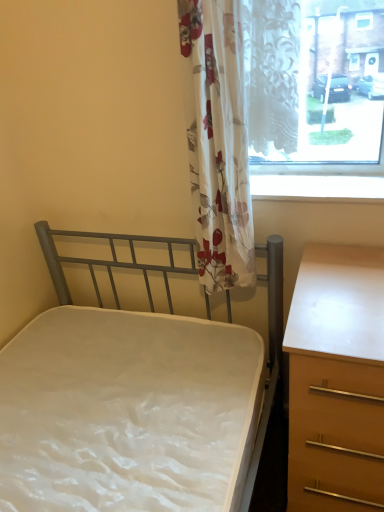
Question: Is metallic gray bed at center-left taller or shorter than floral fabric curtain at center?

Choices:
 (A) tall
 (B) short

Answer: (A)

Question: From the image's perspective, is metallic gray bed at center-left positioned above or below floral fabric curtain at center?

Choices:
 (A) below
 (B) above

Answer: (A)

Question: Which is farther from the metallic gray bed at center-left?

Choices:
 (A) white glossy window sill at upper center
 (B) light brown wood chest of drawers at right
 (C) floral fabric curtain at center

Answer: (A)

Question: Which of these objects is positioned closest to the white glossy window sill at upper center?

Choices:
 (A) floral fabric curtain at center
 (B) metallic gray bed at center-left
 (C) light brown wood chest of drawers at right

Answer: (A)